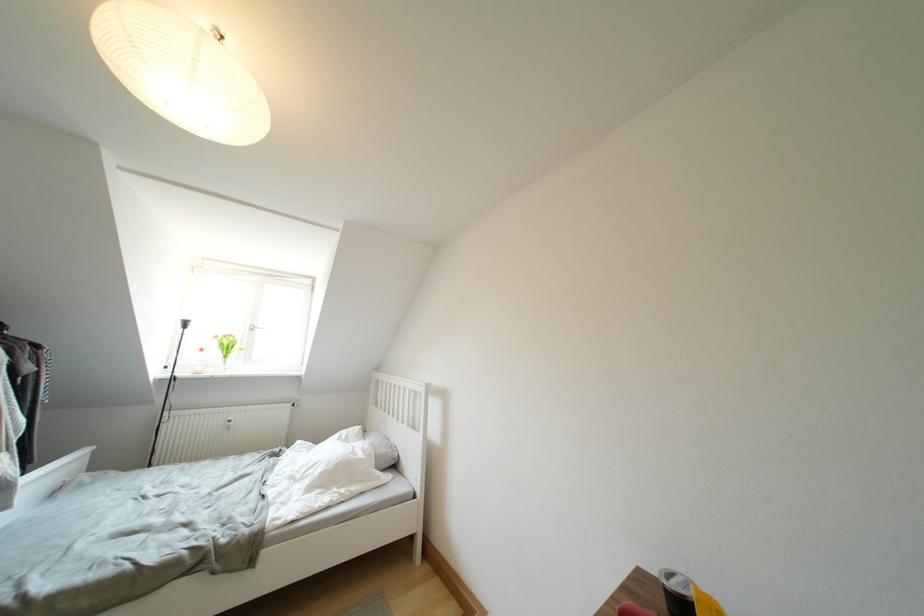
You are a GUI agent. You are given a task and a screenshot of the screen. Output one action in this format:
    pyautogui.click(x=<x>, y=<y>)
    Task: Click on the black cup
    This screenshot has width=924, height=616.
    Given the screenshot: What is the action you would take?
    pyautogui.click(x=676, y=593)